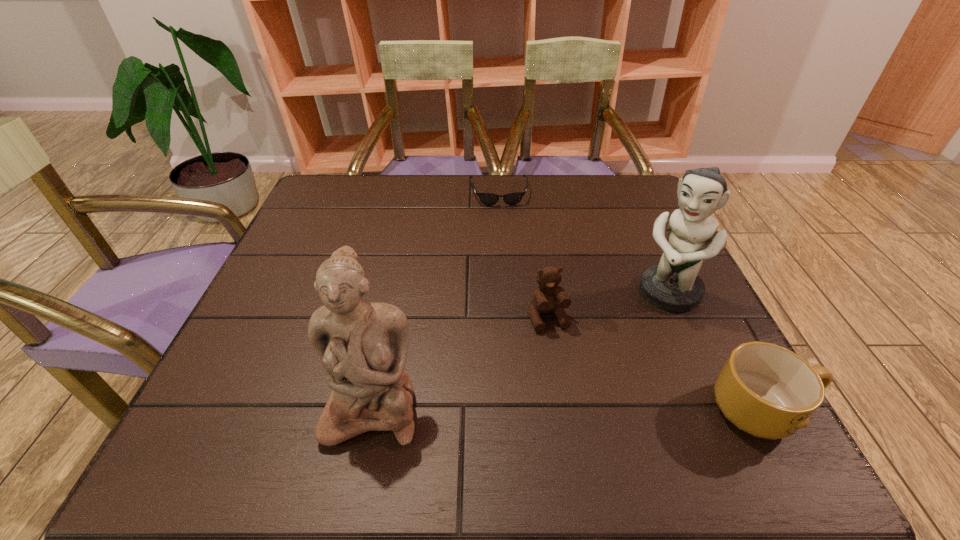
Image resolution: width=960 pixels, height=540 pixels. What are the coordinates of `the fourth closest object to the shortest object` in the screenshot? It's located at (768, 391).

Identify the location of vacant space that satisfies the following two spatial constraints: 1. on the front side of the right figurine; 2. on the right side of the shortest object. (505, 292).

This screenshot has width=960, height=540. I want to click on vacant space that satisfies the following two spatial constraints: 1. on the front-facing side of the fourth tallest object; 2. on the side with the handle of the leftmost object, so click(x=372, y=410).

Locate an element on the screen. The height and width of the screenshot is (540, 960). vacant space that satisfies the following two spatial constraints: 1. on the front side of the second shortest object; 2. on the side with the handle of the teddy bear is located at coordinates (563, 410).

The width and height of the screenshot is (960, 540). I want to click on free space in the image that satisfies the following two spatial constraints: 1. on the front side of the shortest object; 2. on the right side of the farther figurine, so click(505, 292).

Locate an element on the screen. Image resolution: width=960 pixels, height=540 pixels. blank space that satisfies the following two spatial constraints: 1. on the front side of the farther figurine; 2. on the right side of the shortest object is located at coordinates (505, 292).

Identify the location of vacant region that satisfies the following two spatial constraints: 1. on the front side of the shortest object; 2. on the side with the handle of the mug. Image resolution: width=960 pixels, height=540 pixels. pos(512,410).